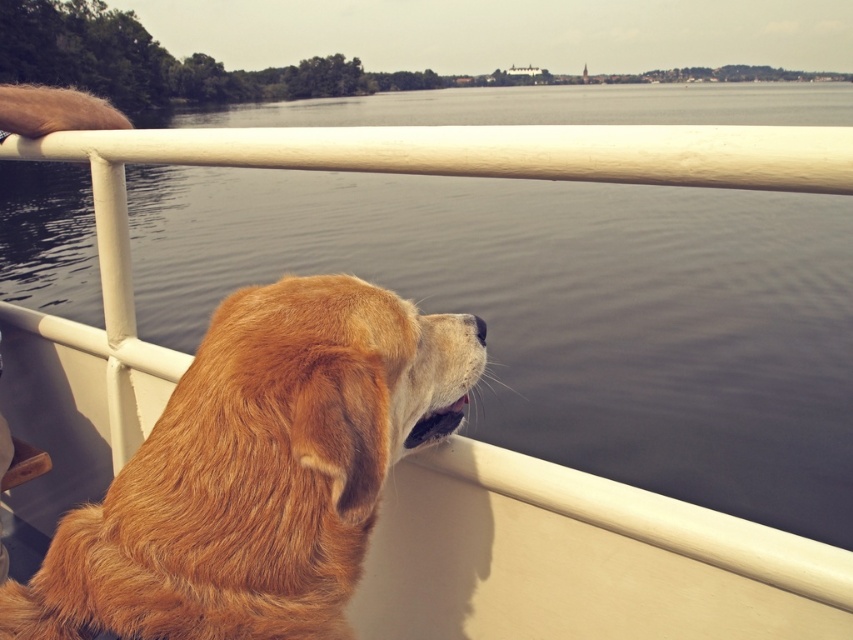
You are standing on the boat and want to take a photo of the smooth water at center. According to the coordinates provided, where should you aim your camera?

The smooth water at center is located at coordinates point (567, 312), so you should aim your camera there.

Based on the photo, you are standing on the deck of a boat and want to reach a point marked at coordinates point (x=461, y=257). If you can walk 30 feet in one minute, how long will it take you to reach that point?

The distance between you and point (x=461, y=257) is 31.52 feet. Since you can walk 30 feet per minute, it will take approximately 1.05 minutes to reach the point.

You are on a boat and want to know if the smooth water at center is higher than the golden fur dog at left. Can you tell me based on the scene?

The smooth water at center is taller than golden fur dog at left, so yes, the smooth water at center is higher than the golden fur dog at left.